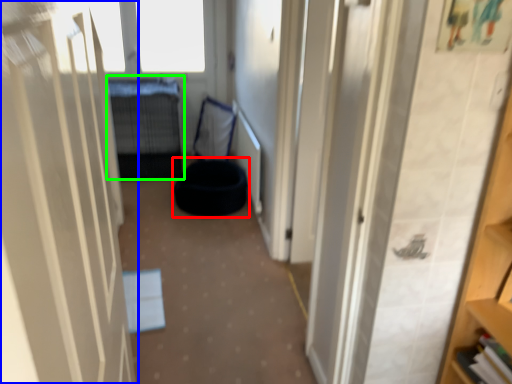
Question: Considering the real-world distances, which object is closest to bean bag chair (highlighted by a red box)? door (highlighted by a blue box) or bed (highlighted by a green box).

Choices:
 (A) door
 (B) bed

Answer: (B)